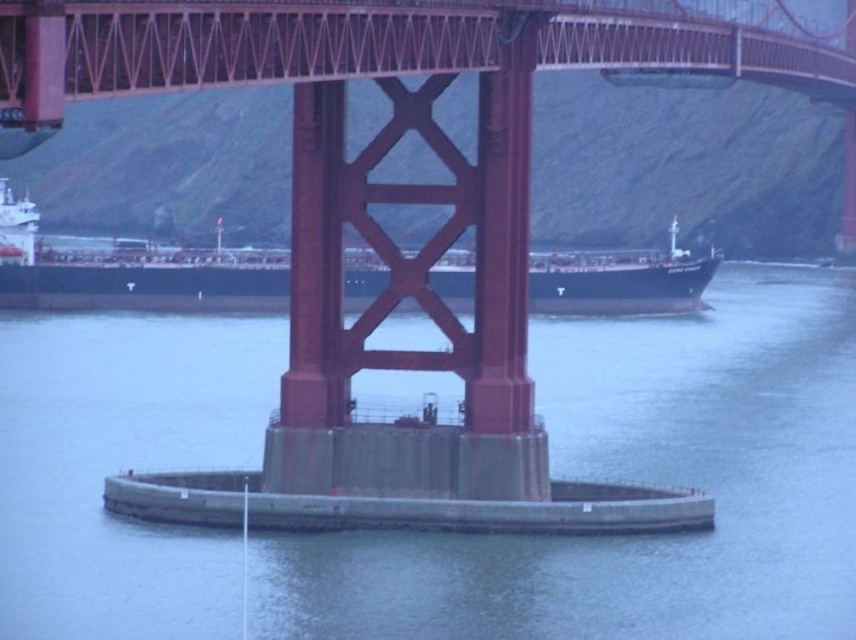
Question: Does gray concrete water at center have a lesser width compared to black matte ship at center?

Choices:
 (A) no
 (B) yes

Answer: (A)

Question: Which point is farther to the camera?

Choices:
 (A) gray concrete water at center
 (B) black matte ship at center

Answer: (B)

Question: Does gray concrete water at center come in front of black matte ship at center?

Choices:
 (A) no
 (B) yes

Answer: (B)

Question: Is gray concrete water at center positioned behind black matte ship at center?

Choices:
 (A) no
 (B) yes

Answer: (A)